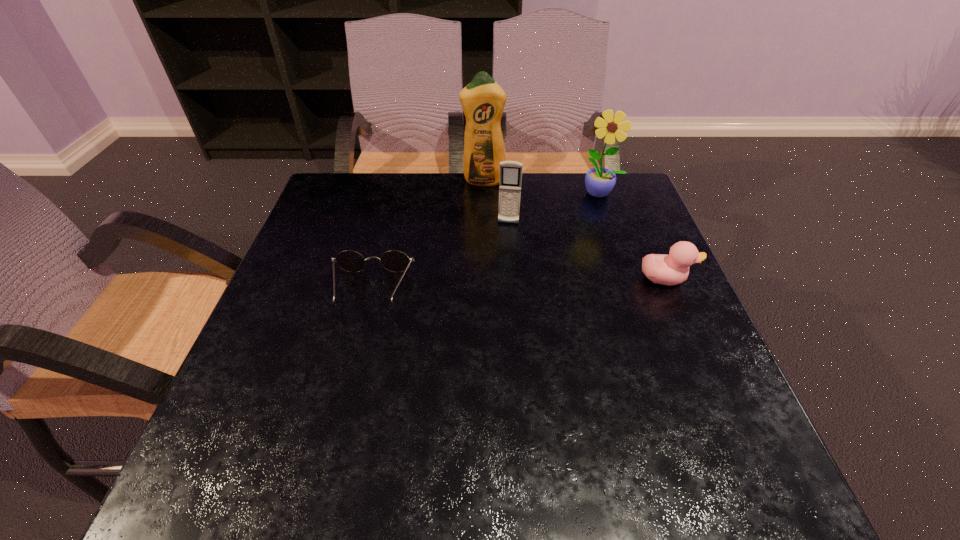
The image size is (960, 540). I want to click on the shortest object, so click(x=395, y=261).

The image size is (960, 540). I want to click on the leftmost object, so click(395, 261).

Find the location of a particular element. This screenshot has width=960, height=540. the fourth tallest object is located at coordinates [x=672, y=269].

Where is `sunflower`? The height and width of the screenshot is (540, 960). sunflower is located at coordinates (599, 181).

Image resolution: width=960 pixels, height=540 pixels. Find the location of `detergent`. detergent is located at coordinates (483, 100).

The width and height of the screenshot is (960, 540). In order to click on the third farthest object in this screenshot , I will do `click(510, 171)`.

You are a GUI agent. You are given a task and a screenshot of the screen. Output one action in this format:
    pyautogui.click(x=<x>, y=<y>)
    Task: Click on the cellular telephone
    The height and width of the screenshot is (540, 960).
    Given the screenshot: What is the action you would take?
    pyautogui.click(x=510, y=171)

I want to click on vacant space positioned on the front-facing side of the spectacles, so click(342, 409).

Locate an element on the screen. The image size is (960, 540). vacant space located 0.370m on the front-facing side of the fourth shortest object is located at coordinates 555,289.

In order to click on vacant space positioned on the front-facing side of the fourth shortest object in this screenshot , I will do `click(566, 265)`.